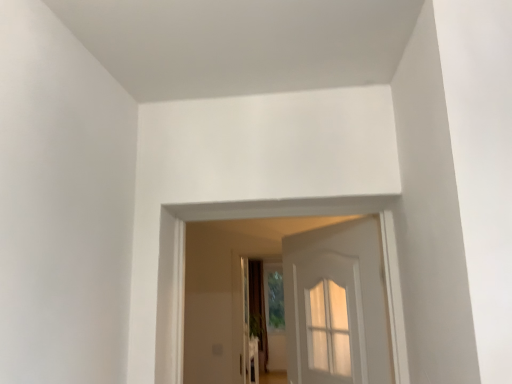
Question: Considering the relative sizes of brown fabric curtain at center and white wooden door at center in the image provided, is brown fabric curtain at center wider than white wooden door at center?

Choices:
 (A) yes
 (B) no

Answer: (A)

Question: Can you confirm if brown fabric curtain at center is taller than white wooden door at center?

Choices:
 (A) no
 (B) yes

Answer: (B)

Question: From the image's perspective, is brown fabric curtain at center beneath white wooden door at center?

Choices:
 (A) no
 (B) yes

Answer: (B)

Question: Considering the relative positions of brown fabric curtain at center and white wooden door at center in the image provided, is brown fabric curtain at center to the left of white wooden door at center from the viewer's perspective?

Choices:
 (A) no
 (B) yes

Answer: (B)

Question: Does brown fabric curtain at center have a lesser height compared to white wooden door at center?

Choices:
 (A) yes
 (B) no

Answer: (B)

Question: Is brown fabric curtain at center placed right next to white wooden door at center?

Choices:
 (A) no
 (B) yes

Answer: (A)

Question: Could you tell me if white wooden door at center is facing brown fabric curtain at center?

Choices:
 (A) yes
 (B) no

Answer: (B)

Question: Considering the relative sizes of white wooden door at center and brown fabric curtain at center in the image provided, is white wooden door at center wider than brown fabric curtain at center?

Choices:
 (A) yes
 (B) no

Answer: (B)

Question: Considering the relative sizes of white wooden door at center and brown fabric curtain at center in the image provided, is white wooden door at center thinner than brown fabric curtain at center?

Choices:
 (A) yes
 (B) no

Answer: (A)

Question: Is white wooden door at center outside of brown fabric curtain at center?

Choices:
 (A) yes
 (B) no

Answer: (A)

Question: Considering the relative sizes of white wooden door at center and brown fabric curtain at center in the image provided, is white wooden door at center shorter than brown fabric curtain at center?

Choices:
 (A) yes
 (B) no

Answer: (A)

Question: From a real-world perspective, is white wooden door at center physically below brown fabric curtain at center?

Choices:
 (A) no
 (B) yes

Answer: (A)

Question: Is white wooden door at center taller or shorter than brown fabric curtain at center?

Choices:
 (A) short
 (B) tall

Answer: (A)